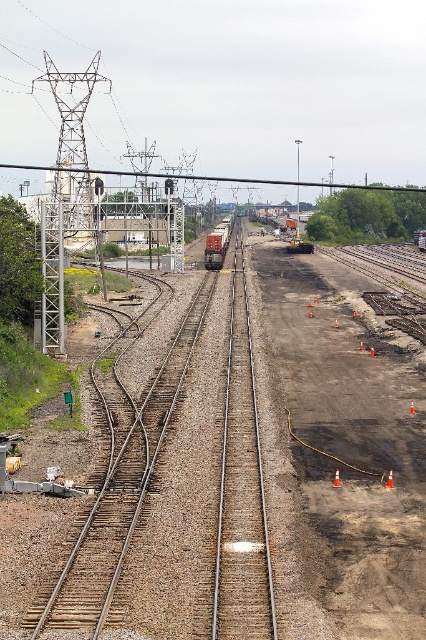
Who is lower down, brown gravel dirt track at center or orange traffic cone at center?

orange traffic cone at center is below.

In the scene shown: Does brown gravel dirt track at center have a greater width compared to orange traffic cone at center?

Yes, brown gravel dirt track at center is wider than orange traffic cone at center.

This screenshot has width=426, height=640. I want to click on brown gravel dirt track at center, so click(350, 449).

Between red container train at center and orange reflective cone at center, which one is positioned lower?

orange reflective cone at center

Is red container train at center thinner than orange reflective cone at center?

No.

Find the location of a particular element. This screenshot has height=640, width=426. red container train at center is located at coordinates (216, 244).

Is black wire at center bigger than red container train at center?

Indeed, black wire at center has a larger size compared to red container train at center.

Who is positioned more to the left, black wire at center or red container train at center?

Positioned to the left is black wire at center.

Is point (386, 186) in front of point (215, 244)?

No, (386, 186) is further to viewer.

Where is `black wire at center`? The width and height of the screenshot is (426, 640). black wire at center is located at coordinates (213, 179).